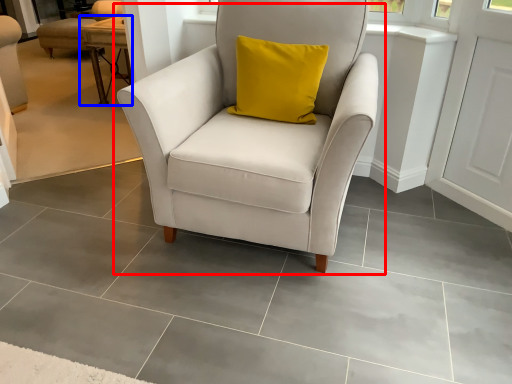
Question: Which object appears farthest to the camera in this image, chair (highlighted by a red box) or table (highlighted by a blue box)?

Choices:
 (A) chair
 (B) table

Answer: (B)